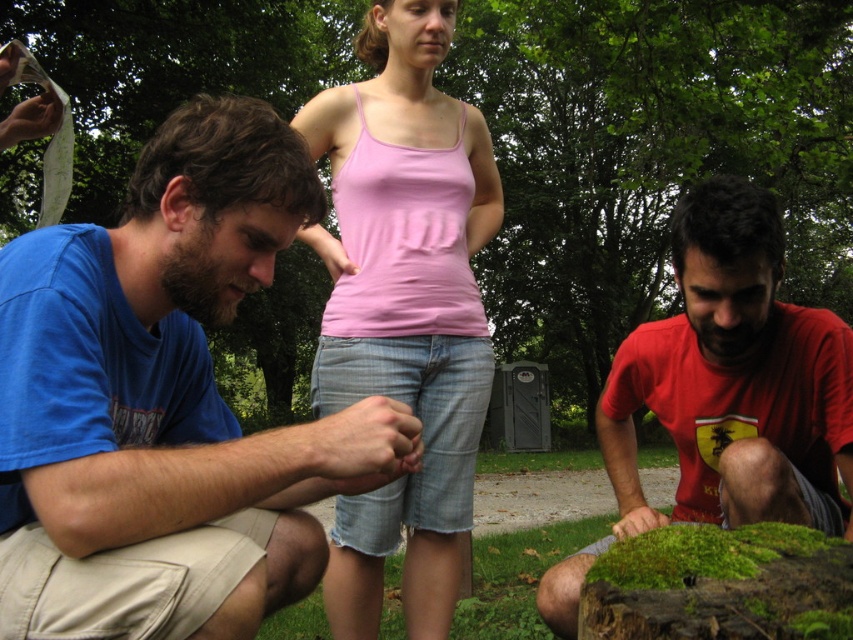
Does blue cotton shirt at left have a lesser width compared to pink cotton tank top at center?

Correct, blue cotton shirt at left's width is less than pink cotton tank top at center's.

Looking at this image, who is lower down, blue cotton shirt at left or pink cotton tank top at center?

Positioned lower is blue cotton shirt at left.

Is point (49, 280) farther from camera compared to point (474, 403)?

No, (49, 280) is in front of (474, 403).

Locate an element on the screen. The height and width of the screenshot is (640, 853). blue cotton shirt at left is located at coordinates (173, 365).

Which is in front, point (428, 634) or point (563, 618)?

Point (563, 618) is in front.

Find the location of a particular element. pink cotton tank top at center is located at coordinates (405, 305).

Who is more forward, (457, 461) or (648, 404)?

Positioned in front is point (648, 404).

The image size is (853, 640). Identify the location of pink cotton tank top at center. (405, 305).

Which is above, blue cotton shirt at left or red matte shirt at lower right?

Positioned higher is blue cotton shirt at left.

Which is behind, point (198, 333) or point (746, 198)?

The point (746, 198) is behind.

Is point (15, 513) closer to camera compared to point (816, 513)?

Yes, point (15, 513) is closer to viewer.

You are a GUI agent. You are given a task and a screenshot of the screen. Output one action in this format:
    pyautogui.click(x=<x>, y=<y>)
    Task: Click on the blue cotton shirt at left
    Image resolution: width=853 pixels, height=640 pixels.
    Given the screenshot: What is the action you would take?
    pos(173,365)